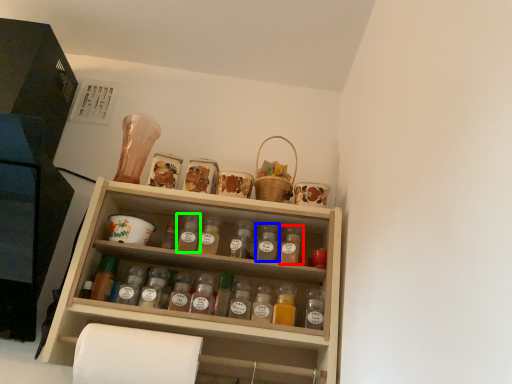
Question: Which is farther away from bottle (highlighted by a red box)? bottle (highlighted by a blue box) or bottle (highlighted by a green box)?

Choices:
 (A) bottle
 (B) bottle

Answer: (B)